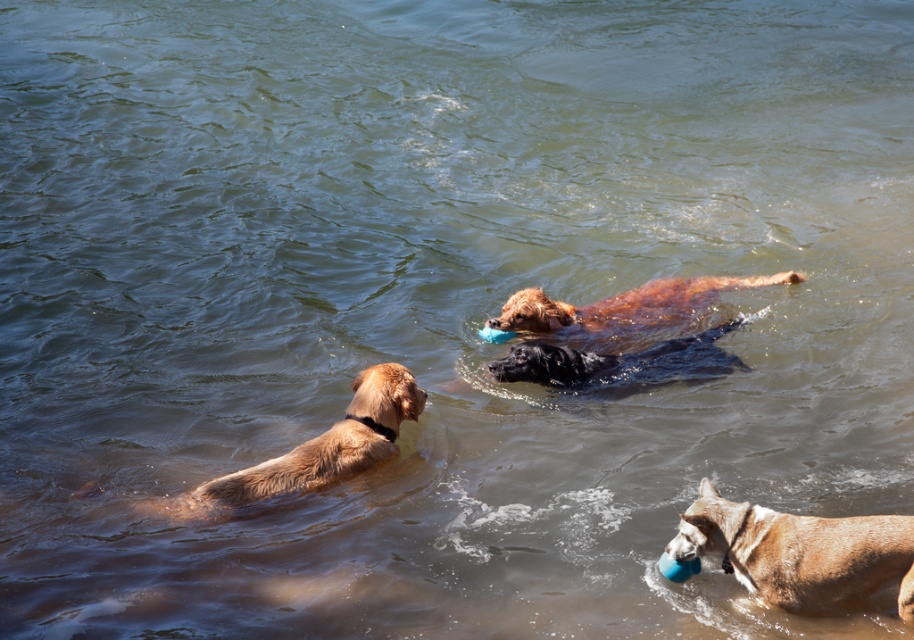
Question: Among these objects, which one is farthest from the camera?

Choices:
 (A) brown furry dog at center
 (B) black rubber dog at center
 (C) golden fur dog at left
 (D) brown matte dog at lower right

Answer: (A)

Question: Is brown matte dog at lower right below brown furry dog at center?

Choices:
 (A) yes
 (B) no

Answer: (A)

Question: Does golden fur dog at left lie behind brown furry dog at center?

Choices:
 (A) no
 (B) yes

Answer: (A)

Question: Which point is farther to the camera?

Choices:
 (A) brown matte dog at lower right
 (B) golden fur dog at left
 (C) brown furry dog at center
 (D) black rubber dog at center

Answer: (C)

Question: In this image, where is brown matte dog at lower right located relative to brown furry dog at center?

Choices:
 (A) above
 (B) below

Answer: (B)

Question: Which is farther from the black rubber dog at center?

Choices:
 (A) brown furry dog at center
 (B) golden fur dog at left
 (C) brown matte dog at lower right

Answer: (C)